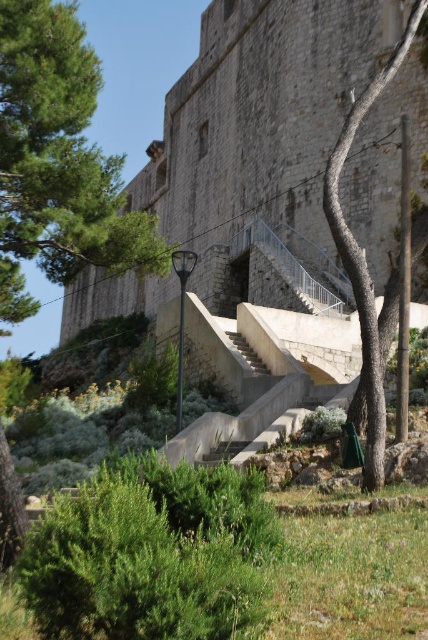
Can you confirm if stone wall at center is smaller than green leafy tree at center?

Actually, stone wall at center might be larger than green leafy tree at center.

Does stone wall at center come in front of green leafy tree at center?

No, stone wall at center is further to the viewer.

Between point (281, 100) and point (324, 189), which one is positioned behind?

Point (281, 100)

Where is `stone wall at center`? The image size is (428, 640). stone wall at center is located at coordinates (282, 195).

Who is more forward, (x=17, y=172) or (x=234, y=332)?

Point (x=17, y=172) is in front.

Is green leafy tree at upper left behind smooth concrete stairs at center?

No, green leafy tree at upper left is closer to the viewer.

I want to click on green leafy tree at upper left, so click(x=58, y=161).

Is point (353, 134) positioned behind point (235, 342)?

No, (353, 134) is in front of (235, 342).

Find the location of `green leafy tree at center`. green leafy tree at center is located at coordinates coord(362,256).